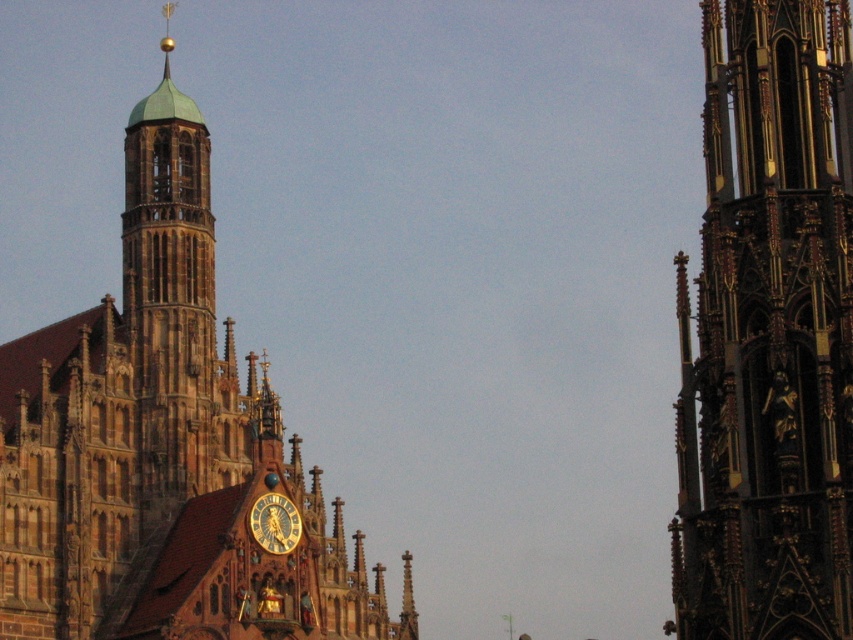
You are standing in front of the historic building and want to take a photo of both the brown stone church at center and the gold metallic clock at center. Since you only have a limited field of view, will you be able to capture both in a single frame without moving your camera?

The brown stone church at center is positioned over the gold metallic clock at center, so they are vertically aligned. This means you can capture both in a single frame as long as your camera includes the vertical space where they overlap.

Based on the coordinates provided, can you identify which object corresponds to the point at (769, 333)?

The point at (769, 333) corresponds to the gold gilded stone tower at right.